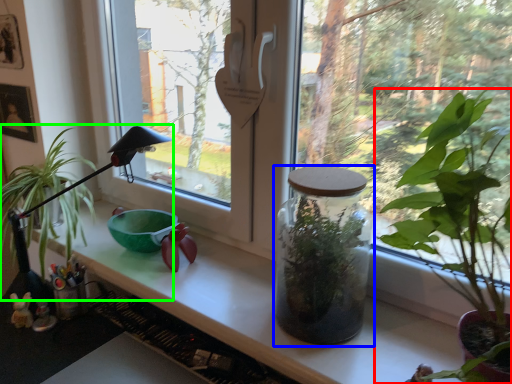
Question: Estimate the real-world distances between objects in this image. Which object is farther from houseplant (highlighted by a red box), glass jar (highlighted by a blue box) or houseplant (highlighted by a green box)?

Choices:
 (A) glass jar
 (B) houseplant

Answer: (B)